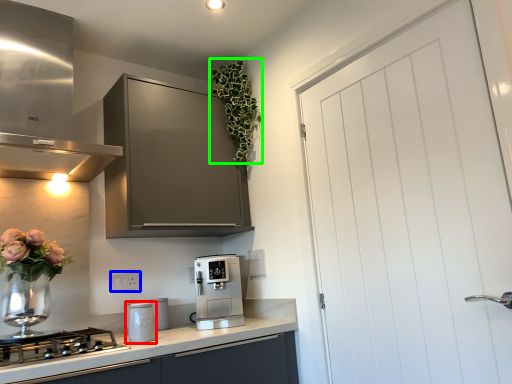
Question: Estimate the real-world distances between objects in this image. Which object is closer to kitchen appliance (highlighted by a red box), electric outlet (highlighted by a blue box) or floral arrangement (highlighted by a green box)?

Choices:
 (A) electric outlet
 (B) floral arrangement

Answer: (A)